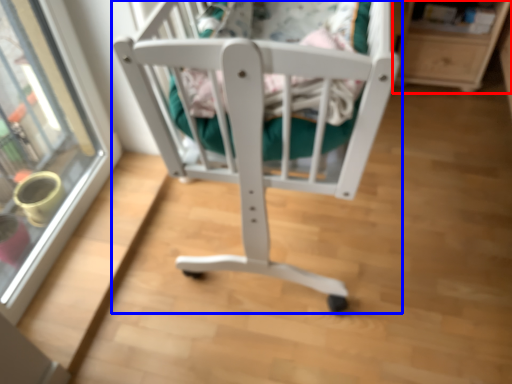
Question: Which of the following is the closest to the observer, shelf (highlighted by a red box) or furniture (highlighted by a blue box)?

Choices:
 (A) shelf
 (B) furniture

Answer: (B)